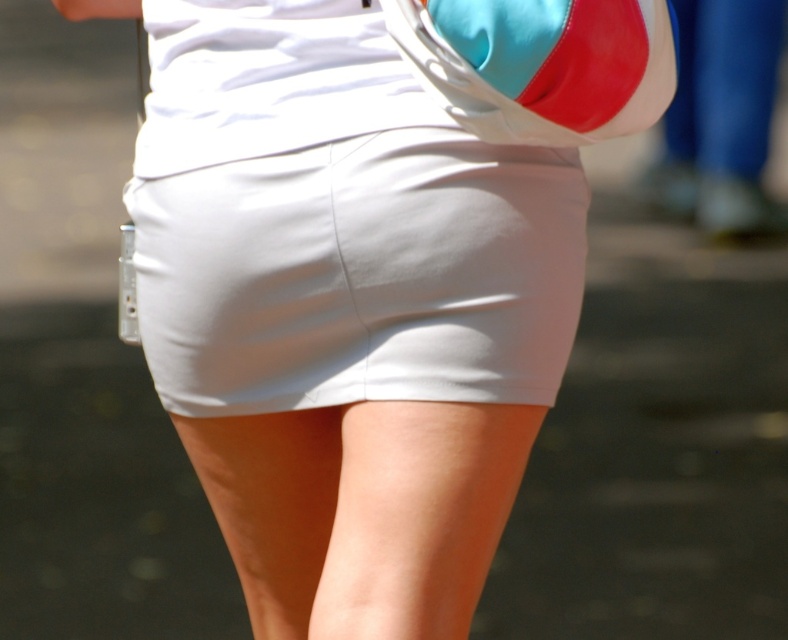
Question: Observing the image, what is the correct spatial positioning of white smooth shorts at center in reference to satin-like turquoise and red shoulder bag at upper center?

Choices:
 (A) right
 (B) left

Answer: (B)

Question: Considering the relative positions of white smooth shorts at center and satin-like turquoise and red shoulder bag at upper center in the image provided, where is white smooth shorts at center located with respect to satin-like turquoise and red shoulder bag at upper center?

Choices:
 (A) left
 (B) right

Answer: (A)

Question: Which of the following is the farthest from the observer?

Choices:
 (A) (197, 413)
 (B) (664, 4)

Answer: (A)

Question: Which object is farther from the camera taking this photo?

Choices:
 (A) satin-like turquoise and red shoulder bag at upper center
 (B) white smooth shorts at center

Answer: (B)

Question: Among these objects, which one is farthest from the camera?

Choices:
 (A) white smooth shorts at center
 (B) satin-like turquoise and red shoulder bag at upper center

Answer: (A)

Question: Does white smooth shorts at center appear under satin-like turquoise and red shoulder bag at upper center?

Choices:
 (A) yes
 (B) no

Answer: (A)